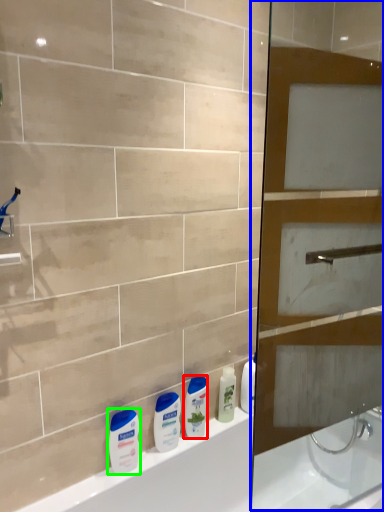
Question: Estimate the real-world distances between objects in this image. Which object is farther from cleaning product (highlighted by a red box), screen door (highlighted by a blue box) or toiletry (highlighted by a green box)?

Choices:
 (A) screen door
 (B) toiletry

Answer: (A)